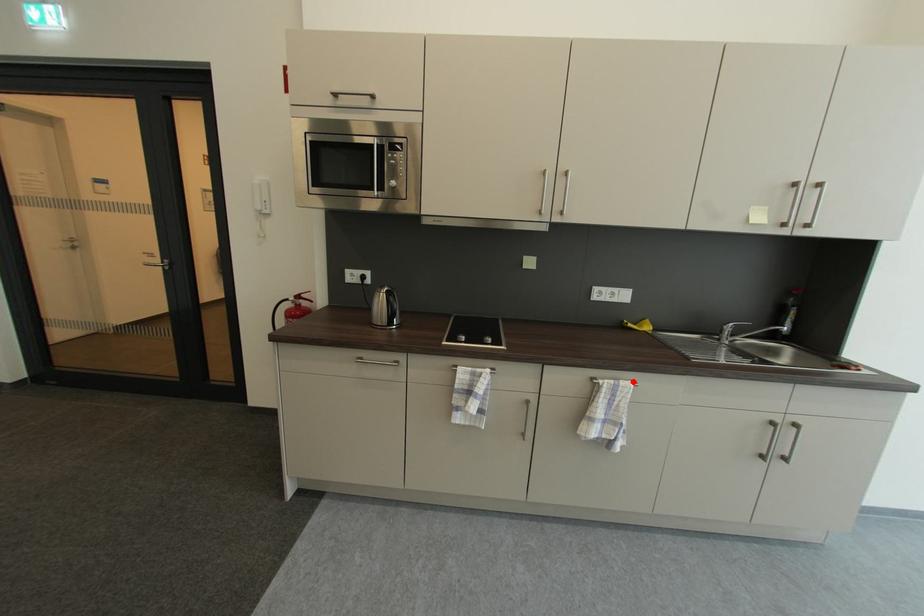
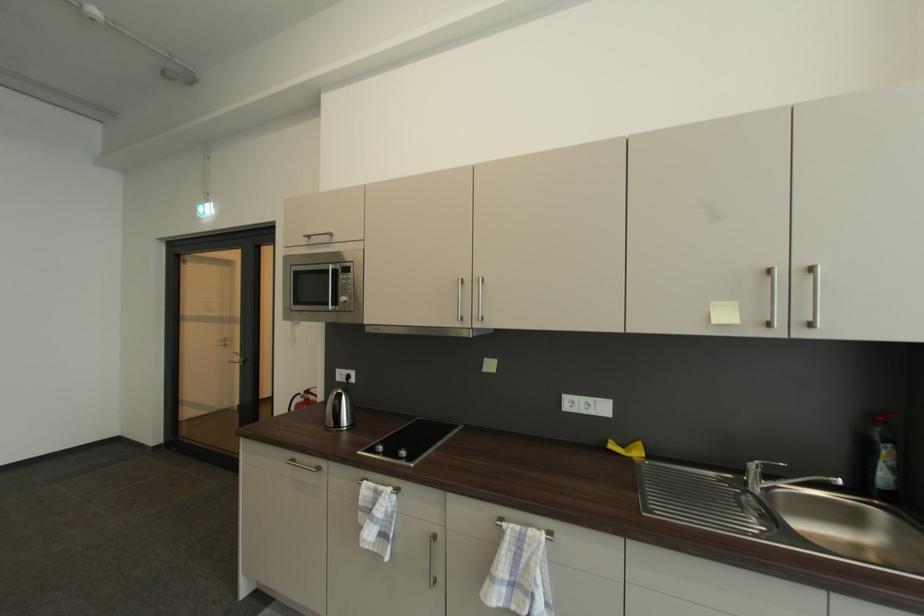
Where in the second image is the point corresponding to the highlighted location from the first image?

(545, 531)